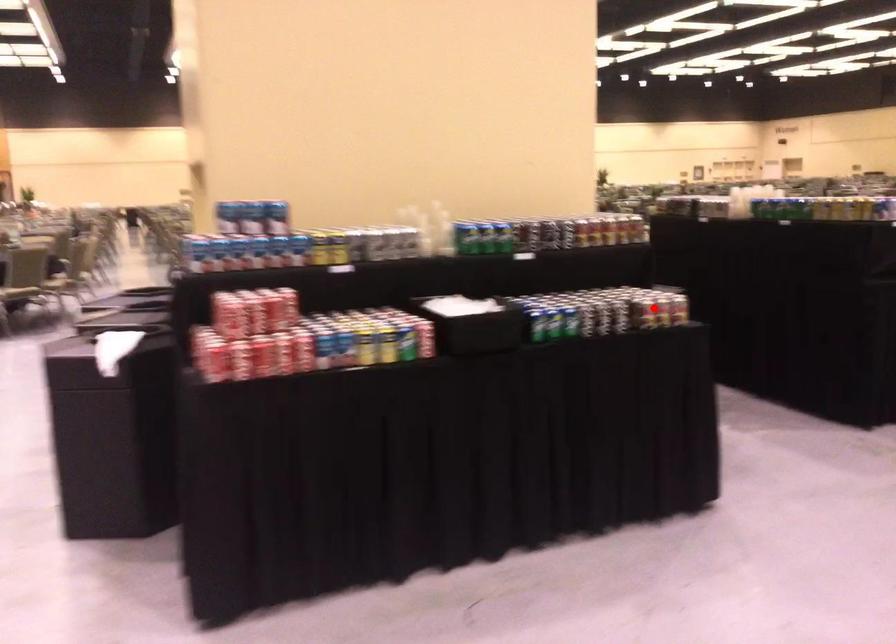
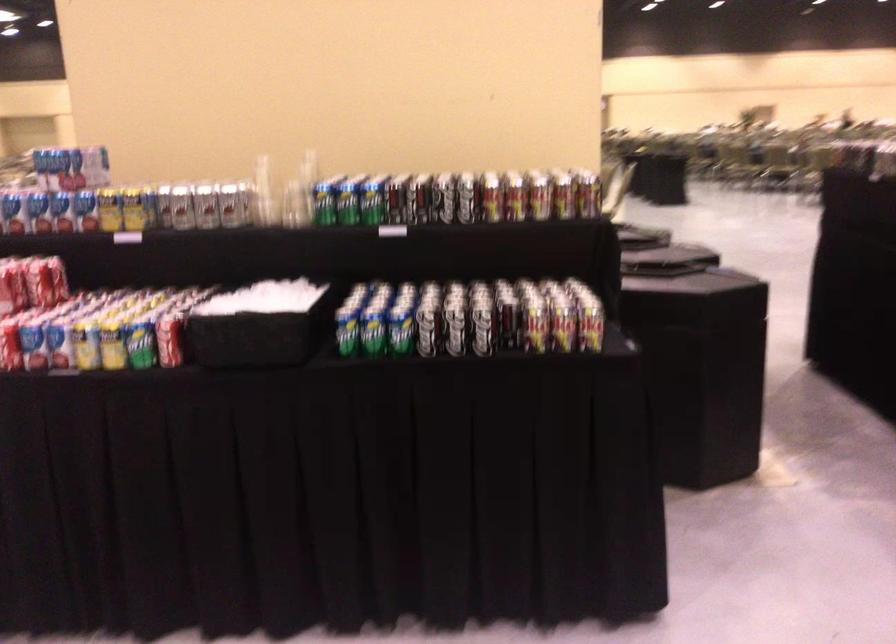
Question: A red point is marked in image1. In image2, is the corresponding 3D point closer to the camera or farther? Reply with the corresponding letter.

Choices:
 (A) The corresponding 3D point is closer.
 (B) The corresponding 3D point is farther.

Answer: (A)